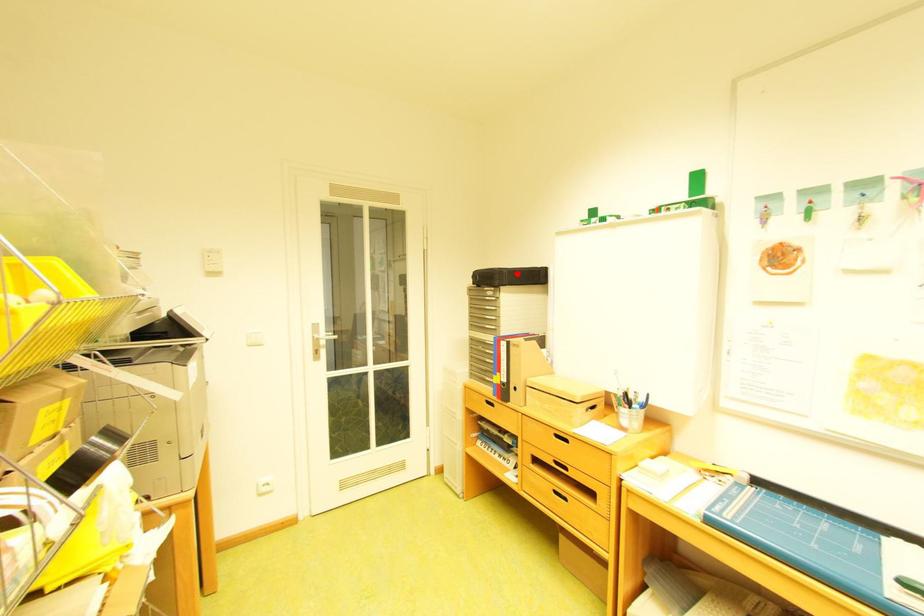
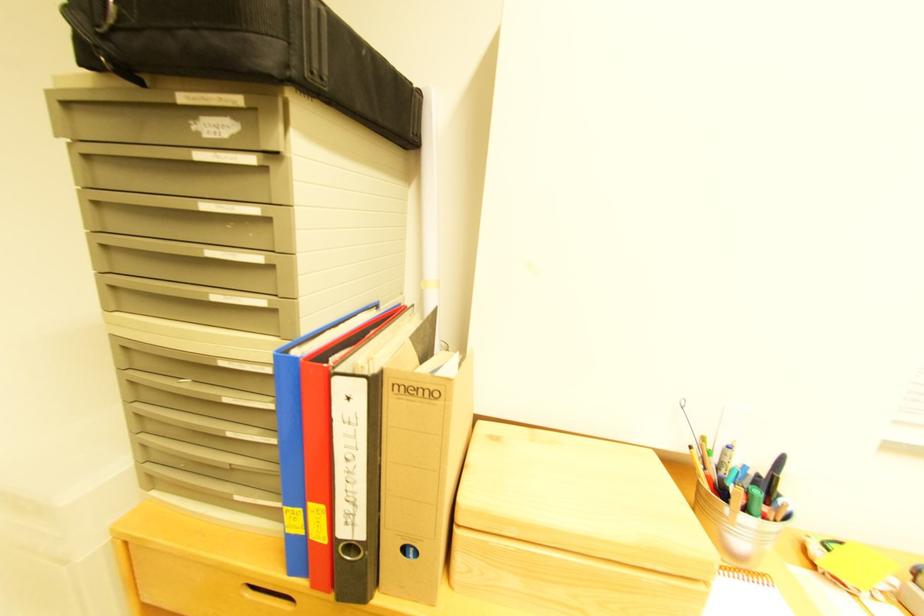
Locate, in the second image, the point that corresponds to the highlighted location in the first image.

(330, 10)